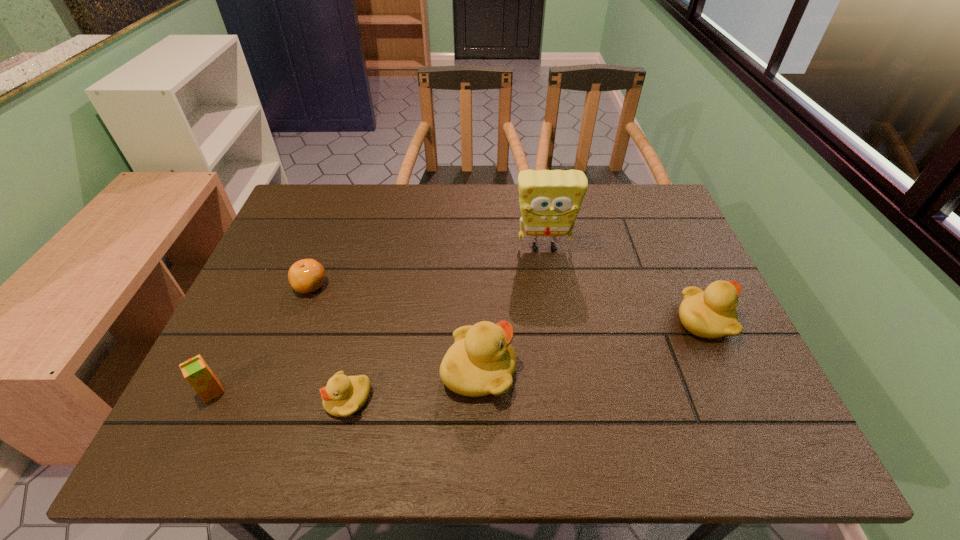
In order to click on spot to insert another duckling for uniform distribution in this screenshot , I will do `click(597, 345)`.